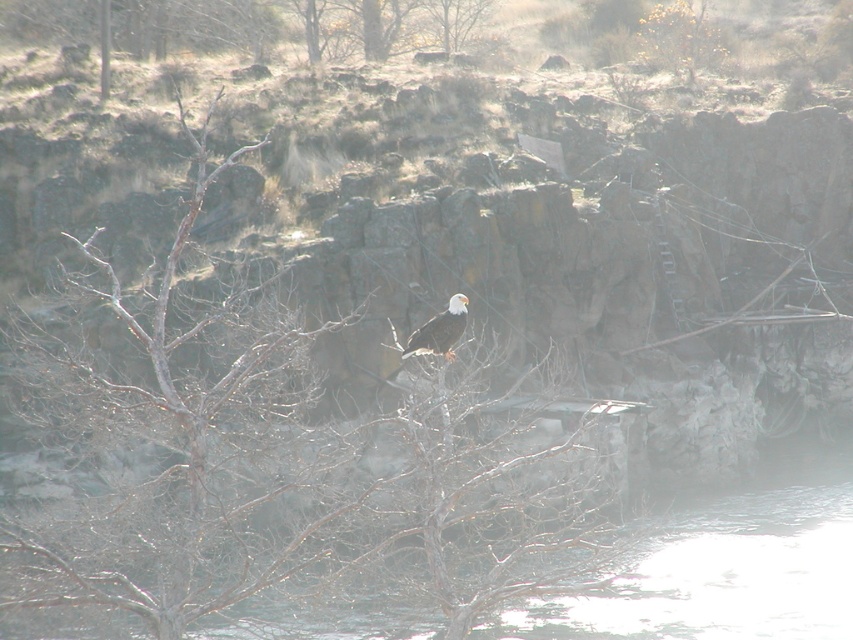
Question: Which point is closer to the camera?

Choices:
 (A) (236, 536)
 (B) (421, 339)

Answer: (A)

Question: Among these objects, which one is farthest from the camera?

Choices:
 (A) white feathered eagle at center
 (B) bare branches at center

Answer: (A)

Question: Is bare branches at center positioned behind white feathered eagle at center?

Choices:
 (A) yes
 (B) no

Answer: (B)

Question: Does bare branches at center appear on the left side of white feathered eagle at center?

Choices:
 (A) no
 (B) yes

Answer: (B)

Question: Is bare branches at center above white feathered eagle at center?

Choices:
 (A) no
 (B) yes

Answer: (B)

Question: Among these points, which one is nearest to the camera?

Choices:
 (A) click(186, 216)
 (B) click(440, 324)

Answer: (A)